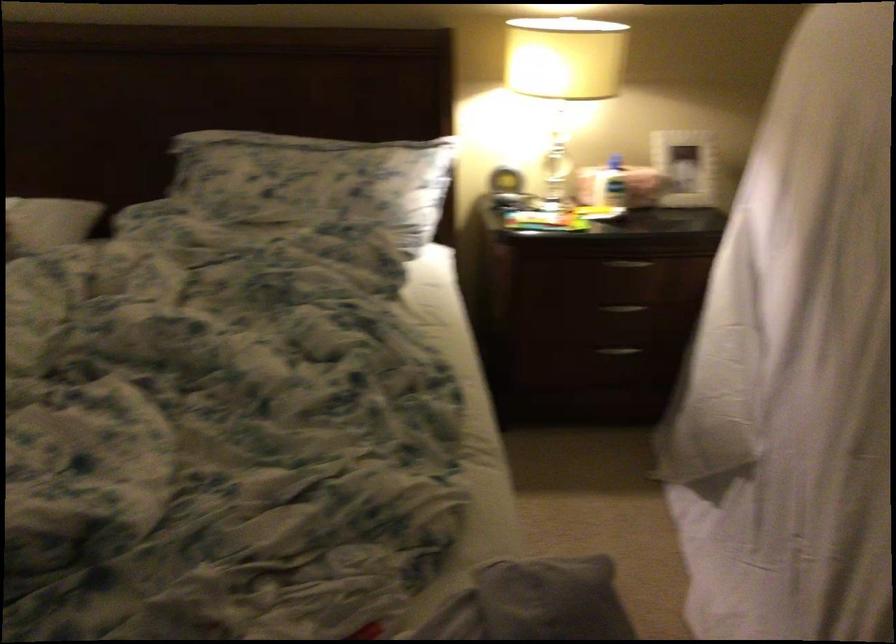
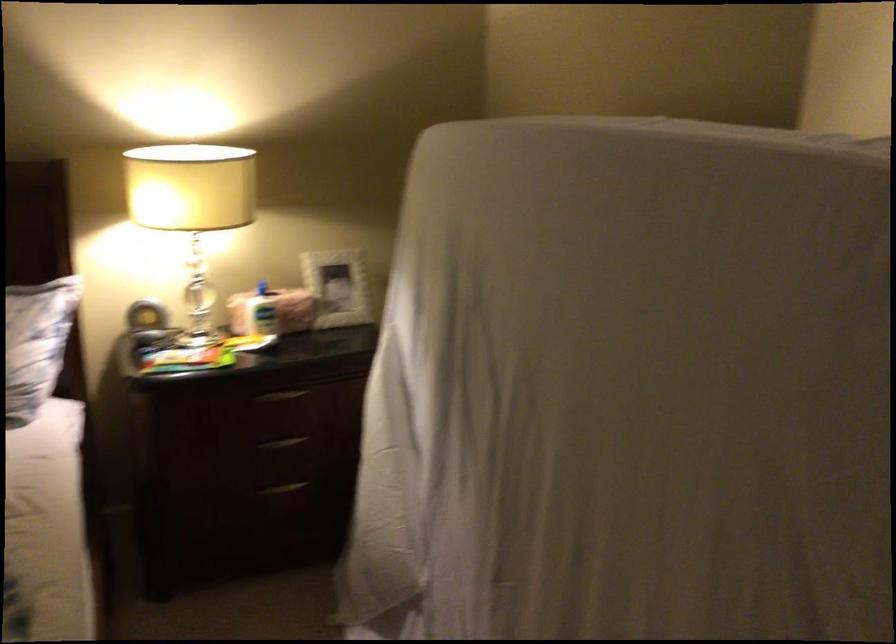
Where in the second image is the point corresponding to the point at 505,176 from the first image?

(145, 316)